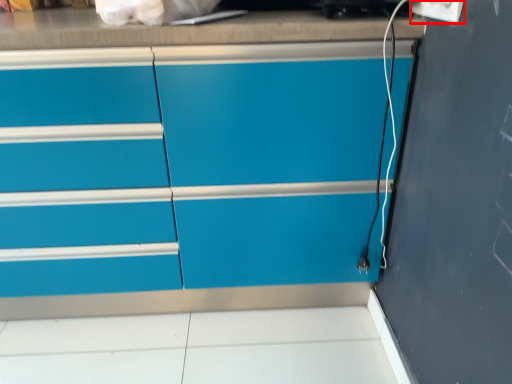
Question: From the image, what is the correct spatial relationship of electric outlet (annotated by the red box) in relation to chest of drawers?

Choices:
 (A) right
 (B) left

Answer: (A)